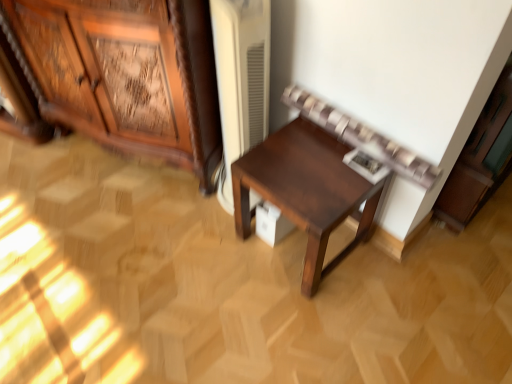
I want to click on free space in front of dark wood table at center, so click(313, 323).